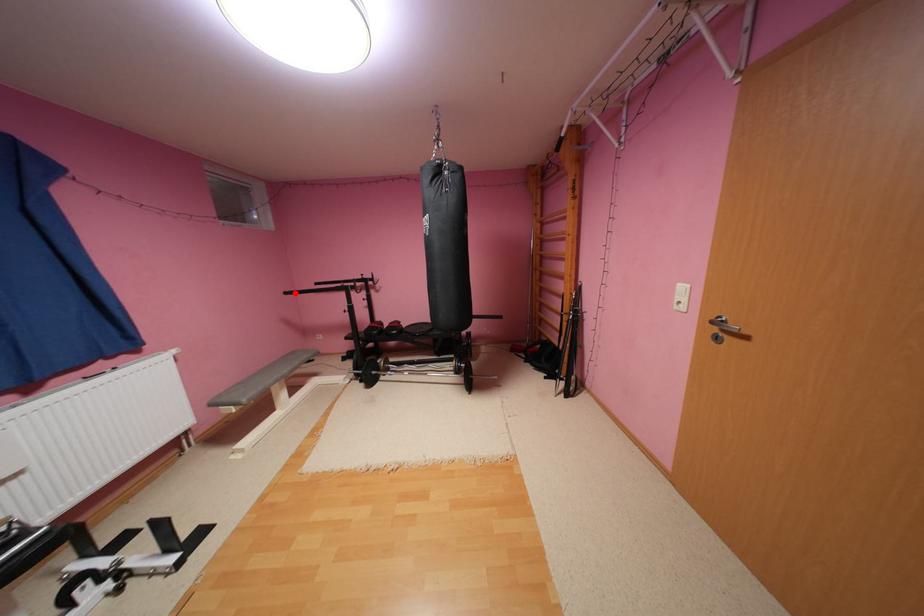
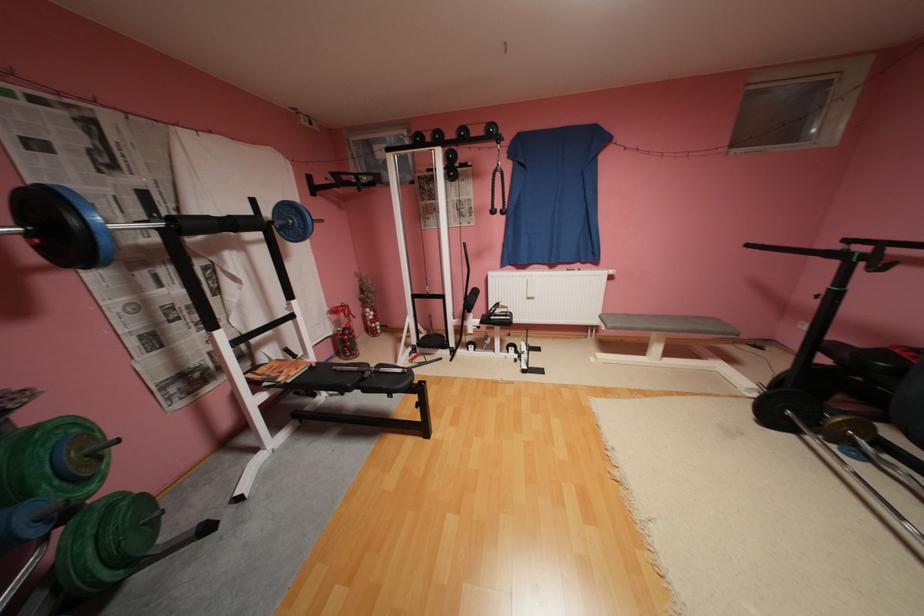
Question: I am providing you with two images of the same scene from different viewpoints. In image1, a red point is highlighted. Considering the same 3D point in image2, which of the following is correct?

Choices:
 (A) It is closer
 (B) It is farther

Answer: (B)